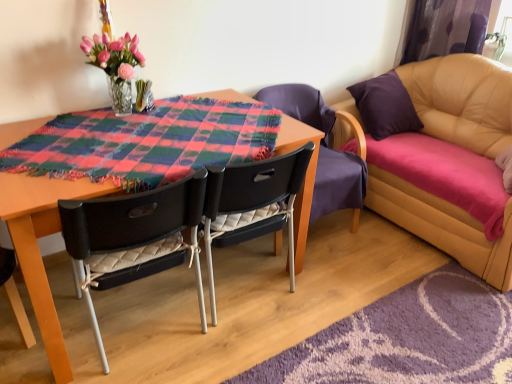
Question: Considering the relative sizes of black quilted fabric chair at center, the third chair positioned from the right, and translucent glass vase at upper left in the image provided, is black quilted fabric chair at center, the third chair positioned from the right, wider than translucent glass vase at upper left?

Choices:
 (A) yes
 (B) no

Answer: (A)

Question: Is black quilted fabric chair at center, acting as the first chair starting from the left, positioned in front of translucent glass vase at upper left?

Choices:
 (A) yes
 (B) no

Answer: (A)

Question: Does black quilted fabric chair at center, acting as the first chair starting from the left, have a lesser height compared to translucent glass vase at upper left?

Choices:
 (A) no
 (B) yes

Answer: (A)

Question: Is black quilted fabric chair at center, the third chair positioned from the right, to the right of translucent glass vase at upper left from the viewer's perspective?

Choices:
 (A) yes
 (B) no

Answer: (A)

Question: Can you confirm if black quilted fabric chair at center, acting as the first chair starting from the left, is thinner than translucent glass vase at upper left?

Choices:
 (A) no
 (B) yes

Answer: (A)

Question: Are black quilted fabric chair at center, the third chair positioned from the right, and translucent glass vase at upper left far apart?

Choices:
 (A) yes
 (B) no

Answer: (B)

Question: From a real-world perspective, does black plastic chair at center, the second chair from the right, sit lower than leather couch at right?

Choices:
 (A) no
 (B) yes

Answer: (B)

Question: Does black plastic chair at center, the second chair from the right, appear on the left side of leather couch at right?

Choices:
 (A) yes
 (B) no

Answer: (A)

Question: From a real-world perspective, is black plastic chair at center, the second chair from the right, located higher than leather couch at right?

Choices:
 (A) no
 (B) yes

Answer: (A)

Question: Can you confirm if black plastic chair at center, marked as the second chair in a left-to-right arrangement, is wider than leather couch at right?

Choices:
 (A) no
 (B) yes

Answer: (A)

Question: Is black plastic chair at center, marked as the second chair in a left-to-right arrangement, completely or partially outside of leather couch at right?

Choices:
 (A) yes
 (B) no

Answer: (A)

Question: From the image's perspective, is black plastic chair at center, the second chair from the right, below leather couch at right?

Choices:
 (A) no
 (B) yes

Answer: (B)

Question: Is black quilted fabric chair at center, the third chair positioned from the right, facing away from black plastic chair at center, the second chair from the right?

Choices:
 (A) no
 (B) yes

Answer: (A)